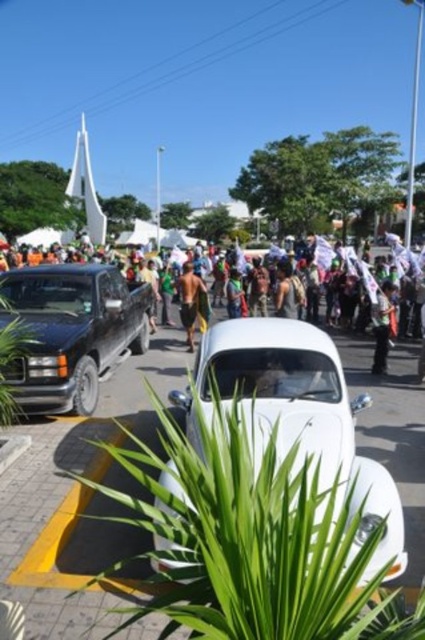
Question: Which object is the closest to the shiny black truck at center?

Choices:
 (A) dark gray fabric shirt at center
 (B) brown textured shorts at center
 (C) white glossy car at center

Answer: (B)

Question: Is white glossy car at center closer to the viewer compared to brown textured shorts at center?

Choices:
 (A) no
 (B) yes

Answer: (B)

Question: Which of the following is the closest to the observer?

Choices:
 (A) shiny black truck at center
 (B) white glossy car at center
 (C) brown textured shorts at center
 (D) dark gray fabric shirt at center

Answer: (B)

Question: Can you confirm if shiny black truck at center is thinner than dark gray fabric shirt at center?

Choices:
 (A) no
 (B) yes

Answer: (A)

Question: Can you confirm if shiny black truck at center is positioned to the left of brown textured shorts at center?

Choices:
 (A) yes
 (B) no

Answer: (A)

Question: Which object is positioned closest to the brown textured shorts at center?

Choices:
 (A) dark gray fabric shirt at center
 (B) white glossy car at center
 (C) shiny black truck at center

Answer: (C)